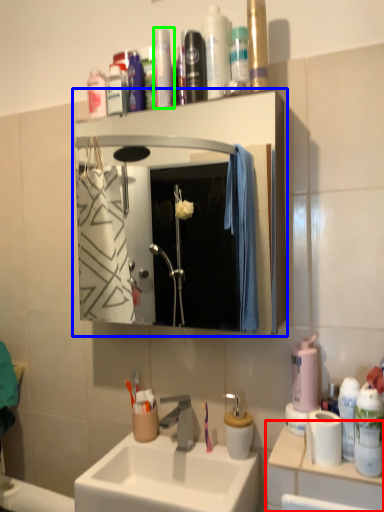
Question: Which is farther away from counter top (highlighted by a red box)? bathroom cabinet (highlighted by a blue box) or toiletry (highlighted by a green box)?

Choices:
 (A) bathroom cabinet
 (B) toiletry

Answer: (A)